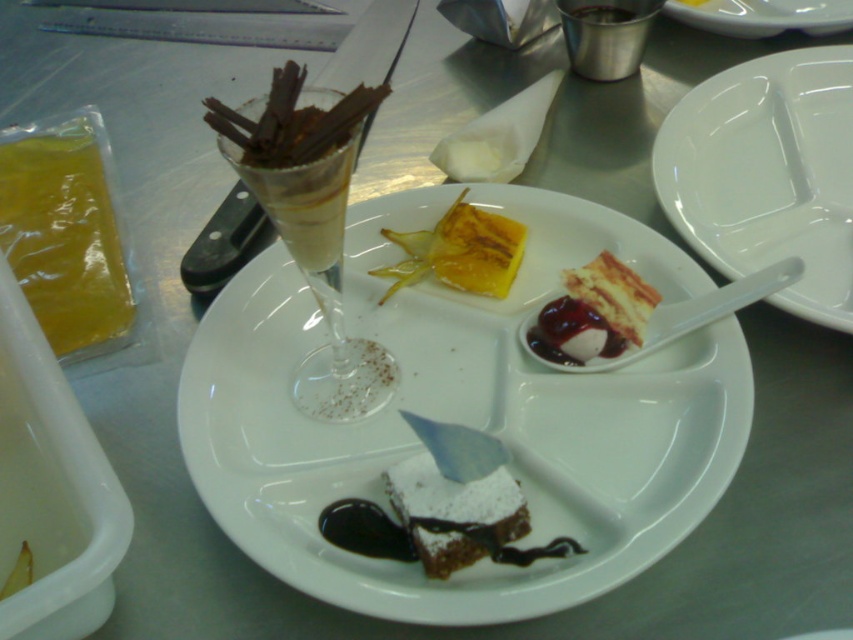
Where is `white glossy plate at upper right`? The width and height of the screenshot is (853, 640). white glossy plate at upper right is located at coordinates (767, 173).

Is white glossy plate at upper right taller than yellow gelatinous slice at center?

Indeed, white glossy plate at upper right has a greater height compared to yellow gelatinous slice at center.

Does point (670, 161) come in front of point (459, 205)?

No.

At what (x,y) coordinates should I click in order to perform the action: click on white glossy plate at upper right. Please return your answer as a coordinate pair (x, y). Looking at the image, I should click on (767, 173).

Is white glossy plate at upper right positioned before clear glass wine glass at center?

No.

This screenshot has width=853, height=640. What do you see at coordinates (767, 173) in the screenshot?
I see `white glossy plate at upper right` at bounding box center [767, 173].

Identify the location of white glossy plate at upper right. Image resolution: width=853 pixels, height=640 pixels. (767, 173).

Between point (247, 544) and point (837, 193), which one is positioned in front?

Point (247, 544) is more forward.

Does white matte plate at center lie in front of white glossy plate at upper right?

That is True.

Identify the location of white matte plate at center. coord(463,413).

Identify the location of white matte plate at center. (463, 413).